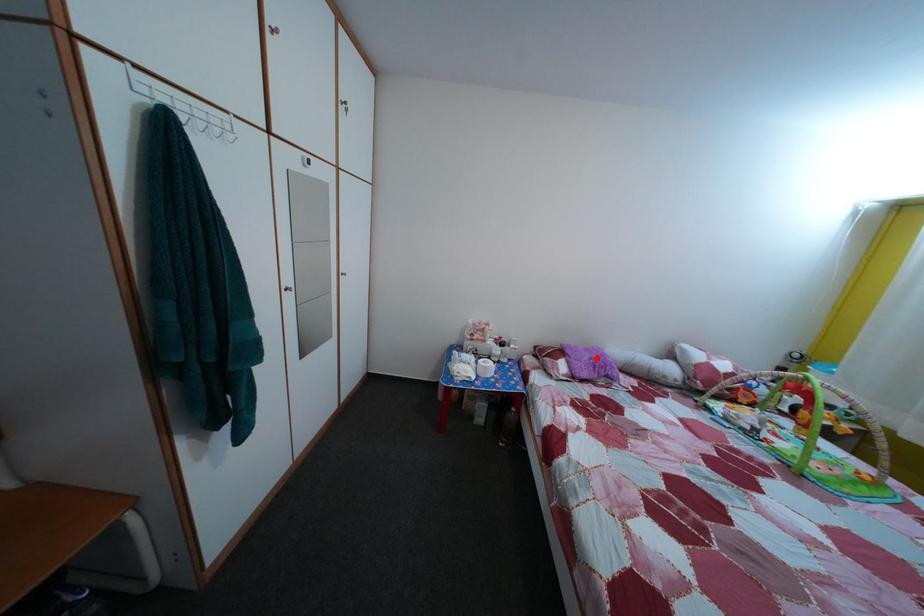
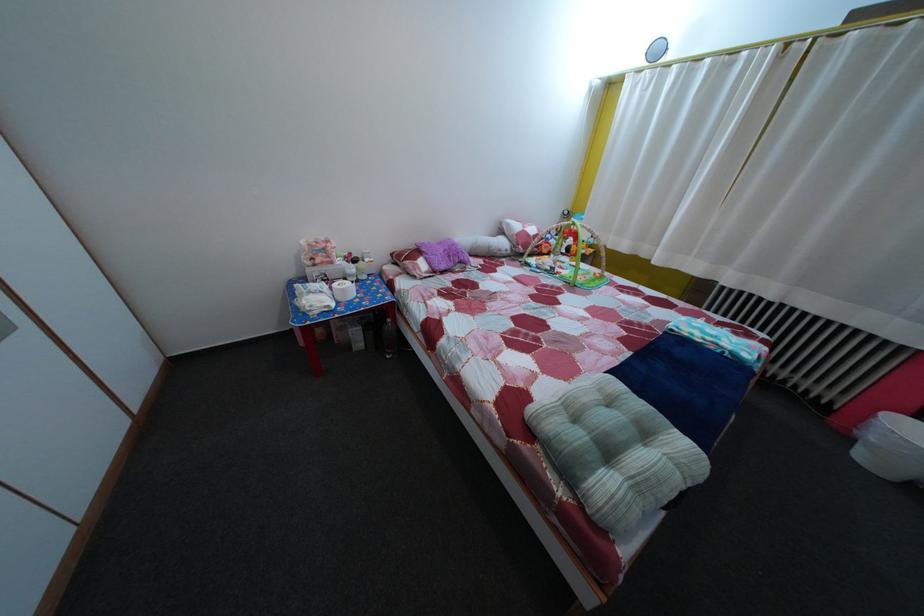
Question: I am providing you with two images of the same scene from different viewpoints. Image1 has a red point marked. In image2, the corresponding 3D location appears at what relative position? Reply with the corresponding letter.

Choices:
 (A) Closer
 (B) Farther

Answer: (A)